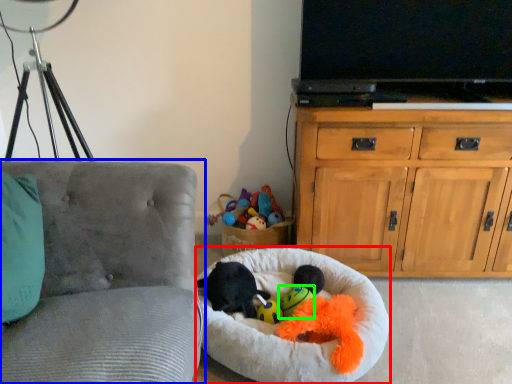
Question: Which object is the closest to the dog bed (highlighted by a red box)? Choose among these: chair (highlighted by a blue box) or toy (highlighted by a green box).

Choices:
 (A) chair
 (B) toy

Answer: (B)